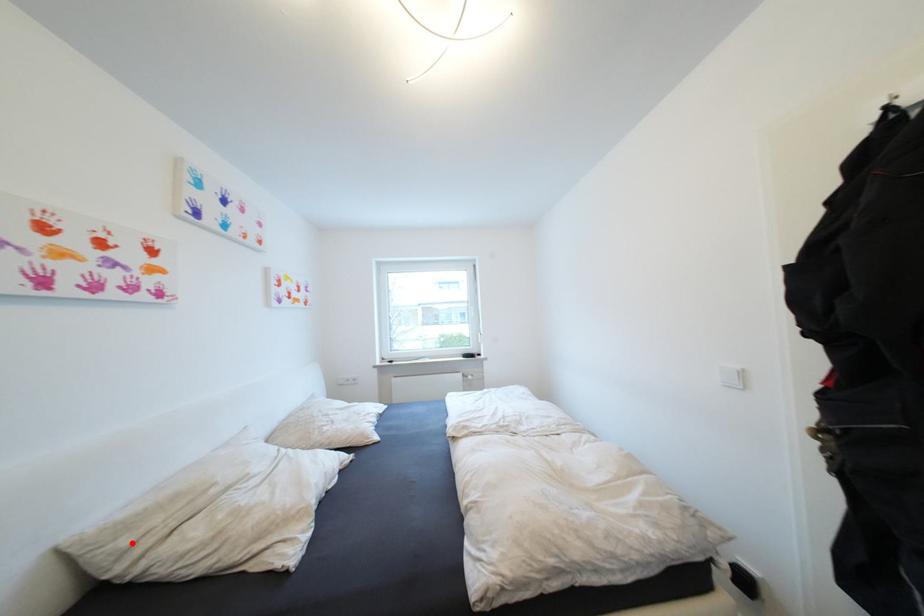
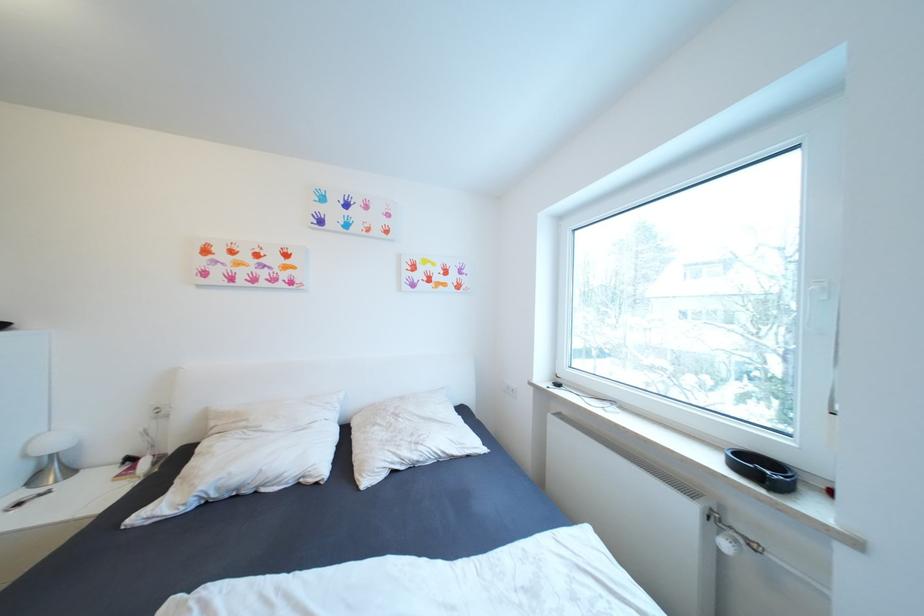
Locate, in the second image, the point that corresponds to the highlighted location in the first image.

(220, 424)